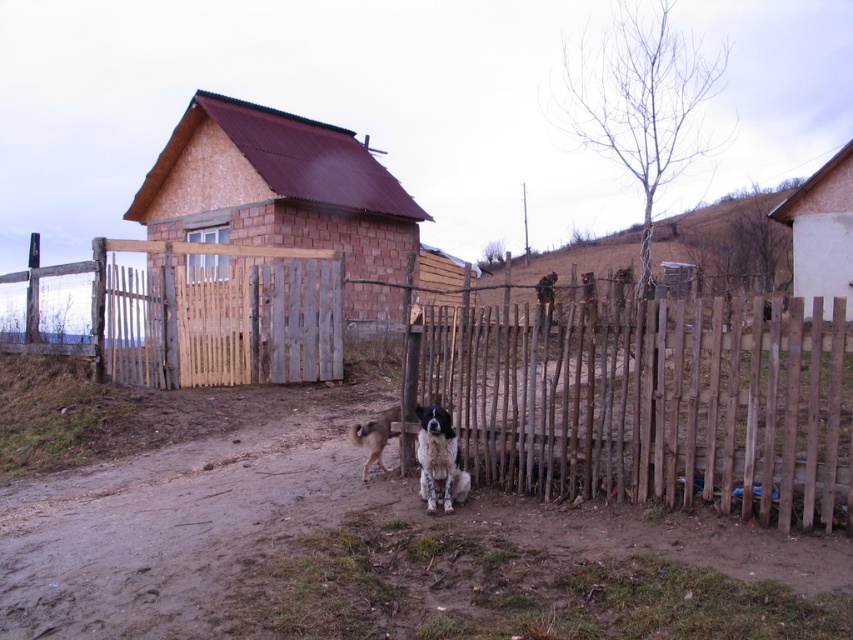
Question: Does wooden fence at center appear over brown dirt field at upper center?

Choices:
 (A) no
 (B) yes

Answer: (A)

Question: Which of these objects is positioned closest to the brown dirt field at upper center?

Choices:
 (A) black and white fur dog at center
 (B) brown dirt track at lower center
 (C) wooden hut at upper right

Answer: (C)

Question: Which point appears closest to the camera in this image?

Choices:
 (A) (790, 433)
 (B) (846, 188)
 (C) (315, 474)
 (D) (747, 429)

Answer: (A)

Question: Which point appears farthest from the camera in this image?

Choices:
 (A) (442, 428)
 (B) (608, 365)
 (C) (793, 195)
 (D) (378, 212)

Answer: (D)

Question: Can you confirm if brown brick hut at center is smaller than wooden hut at upper right?

Choices:
 (A) no
 (B) yes

Answer: (B)

Question: Is wooden fence at center in front of brown dirt field at upper center?

Choices:
 (A) no
 (B) yes

Answer: (B)